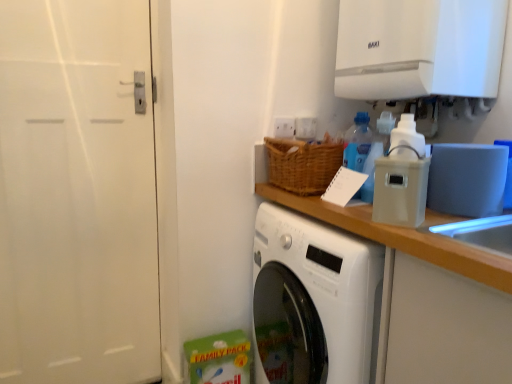
Question: Would you say white matte door at left is inside or outside translucent plastic soap dispenser at upper right, placed as the 1th bottle when sorted from right to left?

Choices:
 (A) inside
 (B) outside

Answer: (B)

Question: Is point (143, 283) positioned closer to the camera than point (373, 145)?

Choices:
 (A) farther
 (B) closer

Answer: (A)

Question: Based on their relative distances, which object is farther from the white glossy exhaust hood at upper right?

Choices:
 (A) white plastic container at upper right
 (B) translucent plastic soap dispenser at upper right, the 2th bottle positioned from the left
 (C) blue translucent bottle at upper right, marked as the first bottle in a left-to-right arrangement
 (D) white matte door at left

Answer: (D)

Question: Considering the real-world distances, which object is closest to the translucent plastic soap dispenser at upper right, placed as the 1th bottle when sorted from right to left?

Choices:
 (A) white matte door at left
 (B) white plastic container at upper right
 (C) white glossy exhaust hood at upper right
 (D) blue translucent bottle at upper right, which appears as the 2th bottle when viewed from the right

Answer: (D)